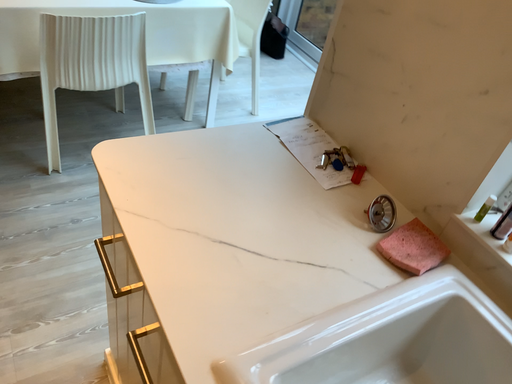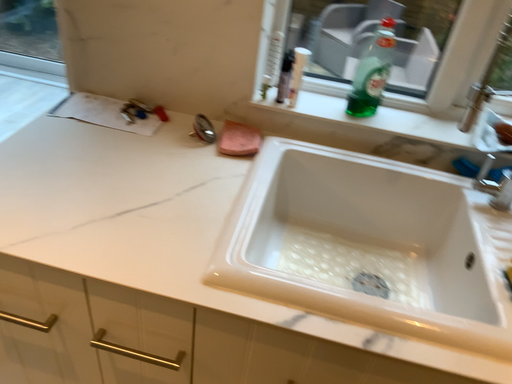
Question: How did the camera likely rotate when shooting the video?

Choices:
 (A) rotated left
 (B) rotated right

Answer: (B)